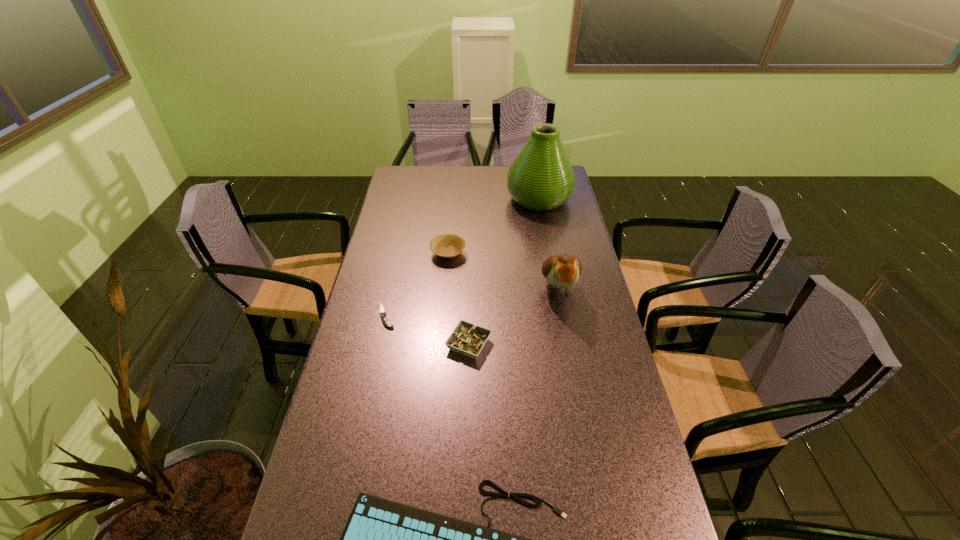
Find the location of a particular element. vacant region located 0.360m on the right of the ashtray is located at coordinates click(x=612, y=344).

At what (x,y) coordinates should I click in order to perform the action: click on vacant region located on the back of the shortest object. Please return your answer as a coordinate pair (x, y). Looking at the image, I should click on (401, 241).

Identify the location of object present at the far edge. (541, 178).

The width and height of the screenshot is (960, 540). Find the location of `object located in the left edge section of the desktop`. object located in the left edge section of the desktop is located at coordinates (382, 312).

You are a GUI agent. You are given a task and a screenshot of the screen. Output one action in this format:
    pyautogui.click(x=<x>, y=<y>)
    Task: Click on the vase that is positioned at the right edge
    Image resolution: width=960 pixels, height=540 pixels.
    Given the screenshot: What is the action you would take?
    pyautogui.click(x=541, y=178)

Image resolution: width=960 pixels, height=540 pixels. Identify the location of bird that is at the right edge. (562, 271).

The image size is (960, 540). In order to click on object at the far right corner in this screenshot , I will do `click(541, 178)`.

This screenshot has width=960, height=540. In the image, there is a desktop. What are the coordinates of `vacant space at the far edge` in the screenshot? It's located at (502, 170).

This screenshot has height=540, width=960. In order to click on vacant space at the left edge in this screenshot , I will do `click(389, 228)`.

Where is `free point at the right edge`? free point at the right edge is located at coordinates (569, 226).